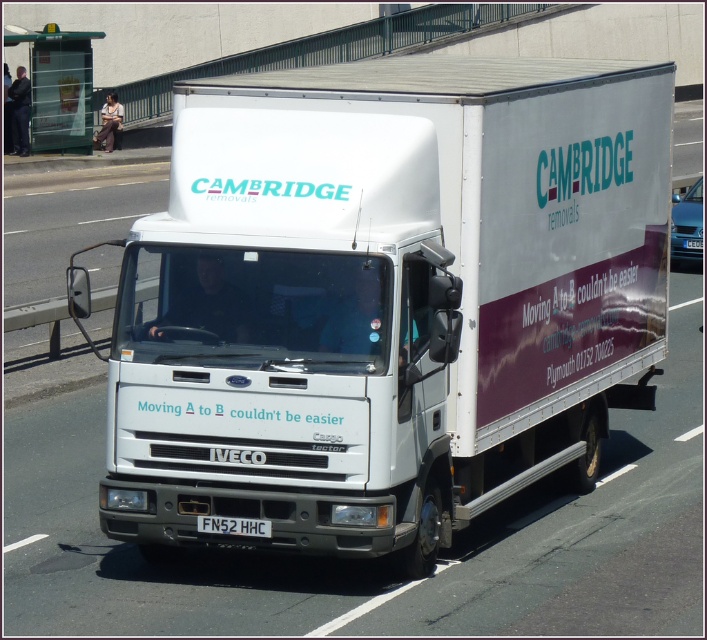
Does white matte truck at center have a greater width compared to white plastic license plate at center?

No.

Can you confirm if white matte truck at center is bigger than white plastic license plate at center?

Correct, white matte truck at center is larger in size than white plastic license plate at center.

Identify the location of white matte truck at center. The height and width of the screenshot is (640, 707). (385, 298).